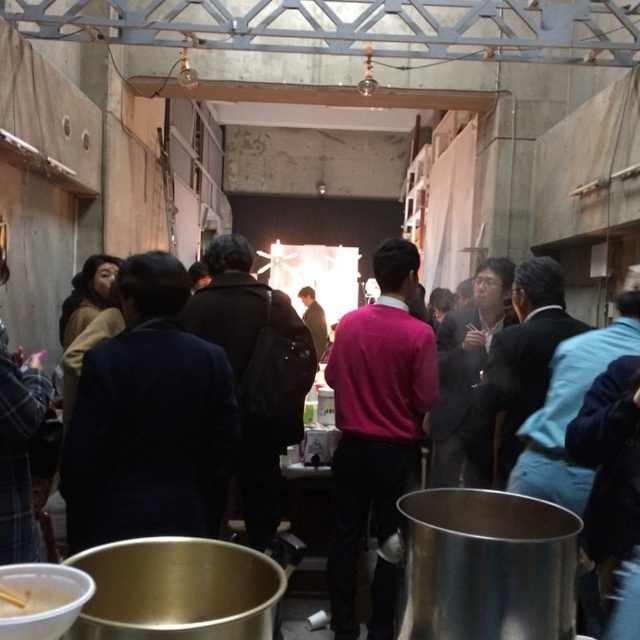
You are organizing a small event and need to place a decorative item on the table. The dark blue suit at center and the white matte bowl at lower left are both available. Which one is more suitable for placing on the table considering their sizes?

The dark blue suit at center has a larger size compared to the white matte bowl at lower left, so it would be more suitable for placing on the table if you need a larger decorative item.

Consider the image. You are at an event and see a dark blue suit at center and a white matte bowl at lower left. Which object is positioned to the left of the other?

The dark blue suit at center is to the left of white matte bowl at lower left.

You are at an event and need to place a small decoration on top of either the dark blue suit at center or the white matte bowl at lower left. Which object should you choose based on stability?

The dark blue suit at center has a greater height compared to the white matte bowl at lower left, so placing the decoration on top of the dark blue suit at center would be more stable due to its height providing a firmer base.